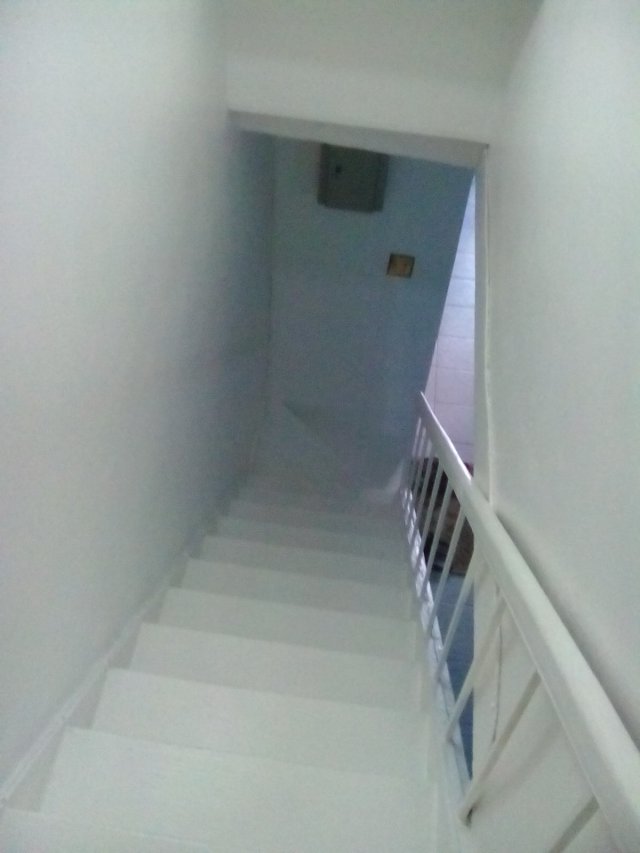
You are a GUI agent. You are given a task and a screenshot of the screen. Output one action in this format:
    pyautogui.click(x=<x>, y=<y>)
    Task: Click on the triangular treads
    
    Given the screenshot: What is the action you would take?
    pyautogui.click(x=305, y=451), pyautogui.click(x=379, y=461)